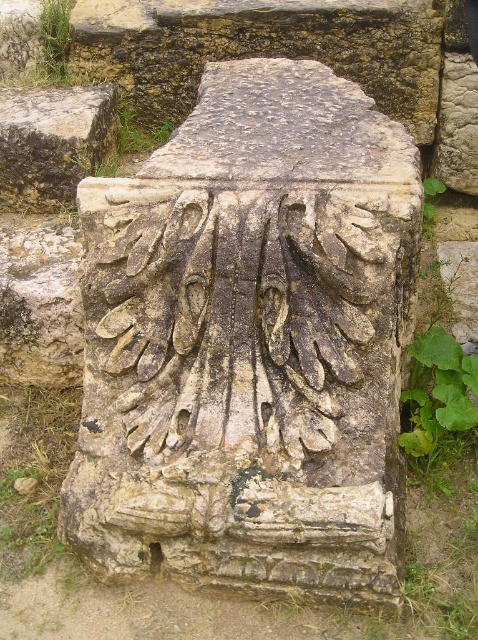
You are an archaeologist examining the ancient stone structure. You notice two carved areas, the rough stone carving at center and the carved stone at upper right. Which carved area is bigger?

The rough stone carving at center is larger in size than the carved stone at upper right.

You are an archaeologist standing at the entrance of the ancient stone structure. You need to locate the carved stone column at center. According to the coordinates provided, where should you look to find it?

The carved stone column at center is located at coordinates point (250,340), so you should look towards the center of the structure to find it.

You are a photographer standing 5 feet away from the rough stone carving at center. You want to capture a detailed closeup shot. Can you move closer to the carving to get a better shot?

The rough stone carving at center is 5.16 feet away from the camera, so you can move closer as you are currently 5 feet away and the distance allows for an additional 1.92 inches to approach.